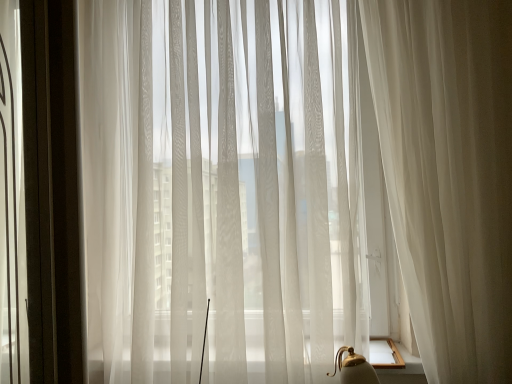
This screenshot has height=384, width=512. What do you see at coordinates (354, 368) in the screenshot?
I see `matte gold lamp at lower right` at bounding box center [354, 368].

The width and height of the screenshot is (512, 384). In order to click on matte gold lamp at lower right in this screenshot , I will do click(x=354, y=368).

I want to click on matte gold lamp at lower right, so click(354, 368).